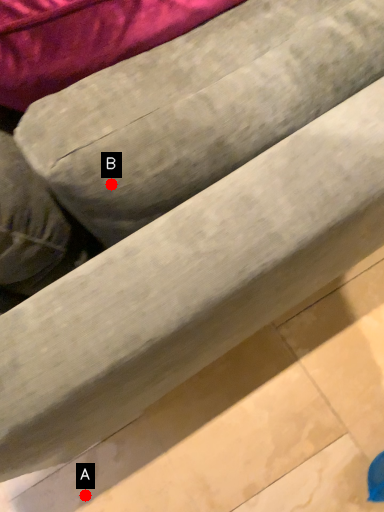
Question: Two points are circled on the image, labeled by A and B beside each circle. Which of the following is the closest to the observer?

Choices:
 (A) A is closer
 (B) B is closer

Answer: (B)